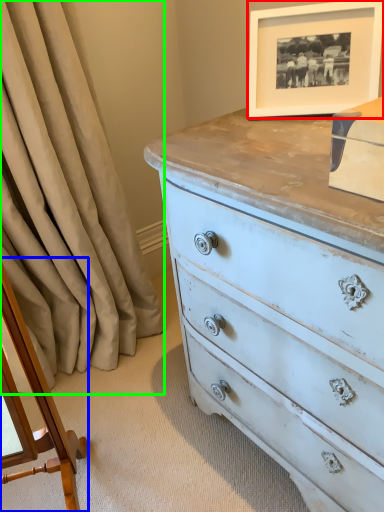
Question: Considering the real-world distances, which object is closest to picture frame (highlighted by a red box)? changing table (highlighted by a blue box) or curtain (highlighted by a green box).

Choices:
 (A) changing table
 (B) curtain

Answer: (B)